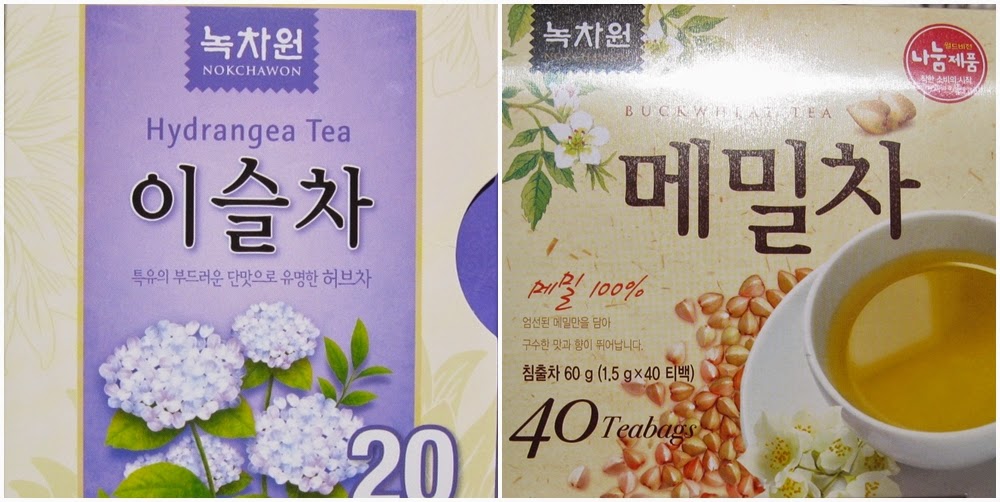
You are a GUI agent. You are given a task and a screenshot of the screen. Output one action in this format:
    pyautogui.click(x=<x>, y=<y>)
    Task: Click on the plate
    This screenshot has width=1000, height=502.
    Given the screenshot: What is the action you would take?
    pyautogui.click(x=777, y=403)